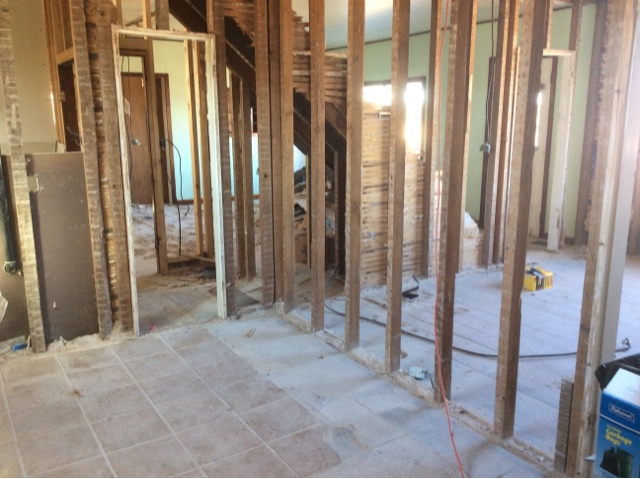
Identify the location of power extension cable. The image size is (640, 479). (452, 435).